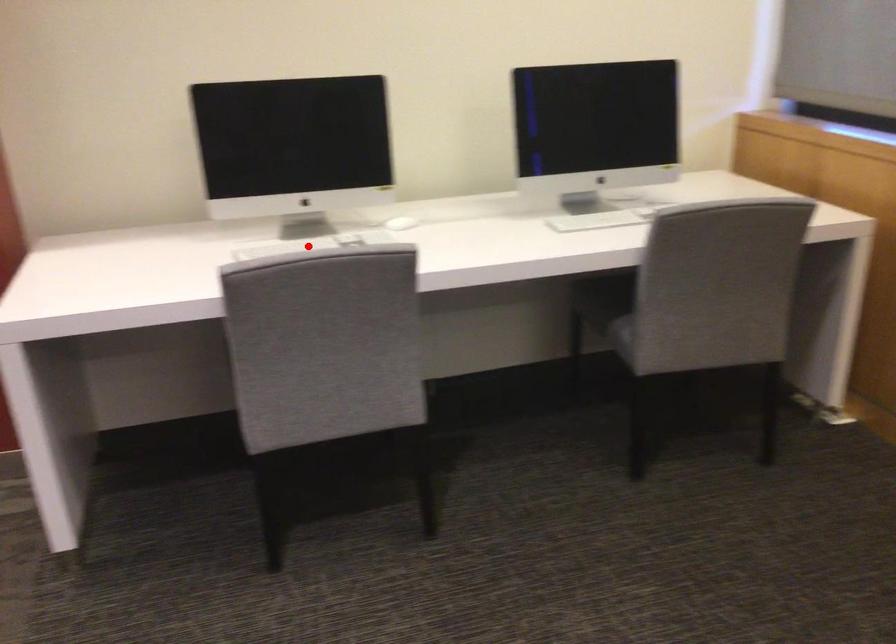
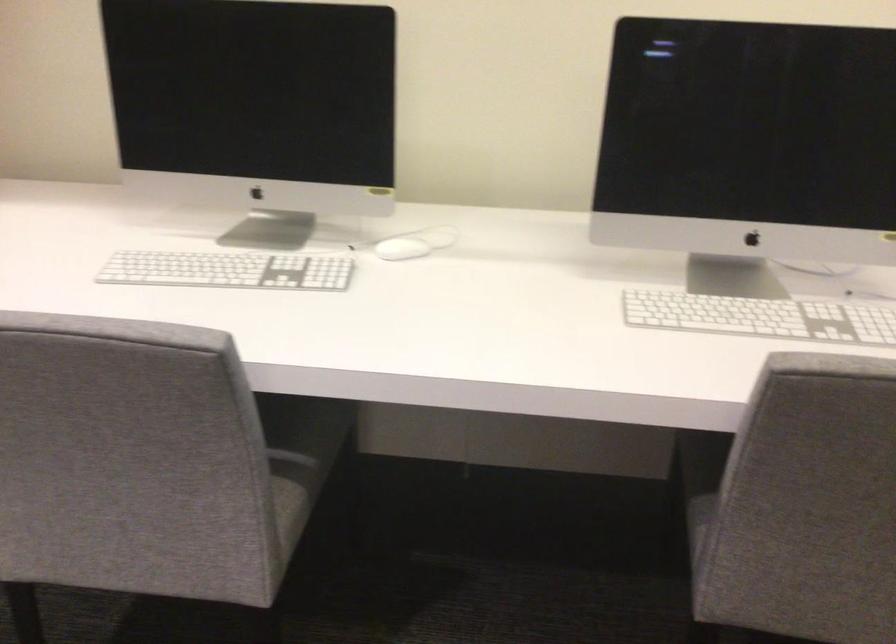
Where in the second image is the point corresponding to the highlighted location from the first image?

(228, 270)